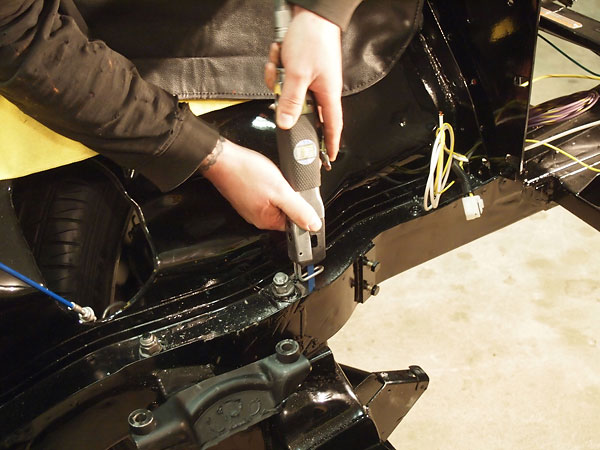
You are a GUI agent. You are given a task and a screenshot of the screen. Output one action in this format:
    pyautogui.click(x=<x>, y=<y>)
    Task: Click on the screws
    
    Given the screenshot: What is the action you would take?
    click(281, 279), click(83, 312), click(152, 340), click(376, 291), click(375, 260)